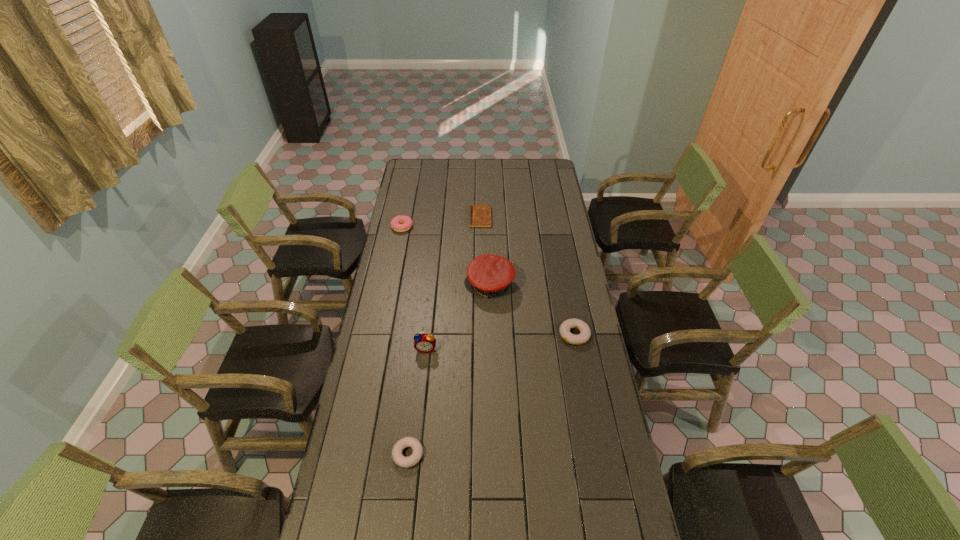
Locate an element on the screen. The width and height of the screenshot is (960, 540). vacant region between the shortest object and the fourth nearest object is located at coordinates (485, 252).

At what (x,y) coordinates should I click in order to perform the action: click on empty space between the alarm clock and the diary. Please return your answer as a coordinate pair (x, y). The width and height of the screenshot is (960, 540). Looking at the image, I should click on (453, 283).

At what (x,y) coordinates should I click in order to perform the action: click on unoccupied position between the third farthest object and the leftmost object. Please return your answer as a coordinate pair (x, y). Looking at the image, I should click on (445, 256).

At what (x,y) coordinates should I click in order to perform the action: click on empty space that is in between the leftmost doughnut and the alarm clock. Please return your answer as a coordinate pair (x, y). The width and height of the screenshot is (960, 540). Looking at the image, I should click on (414, 288).

Locate an element on the screen. vacant space in between the diary and the rightmost doughnut is located at coordinates (527, 276).

Locate an element on the screen. The width and height of the screenshot is (960, 540). vacant region between the second shortest object and the alarm clock is located at coordinates (417, 401).

I want to click on object that ranks as the fifth closest to the cap, so click(402, 461).

This screenshot has width=960, height=540. I want to click on object that stands as the closest to the rightmost object, so click(x=489, y=275).

Select which doughnut appears as the second closest to the rightmost object. Please provide its 2D coordinates. Your answer should be formatted as a tuple, i.e. [(x, y)], where the tuple contains the x and y coordinates of a point satisfying the conditions above.

[(396, 225)]

Select which doughnut appears as the closest to the shortest doughnut. Please provide its 2D coordinates. Your answer should be formatted as a tuple, i.e. [(x, y)], where the tuple contains the x and y coordinates of a point satisfying the conditions above.

[(585, 333)]